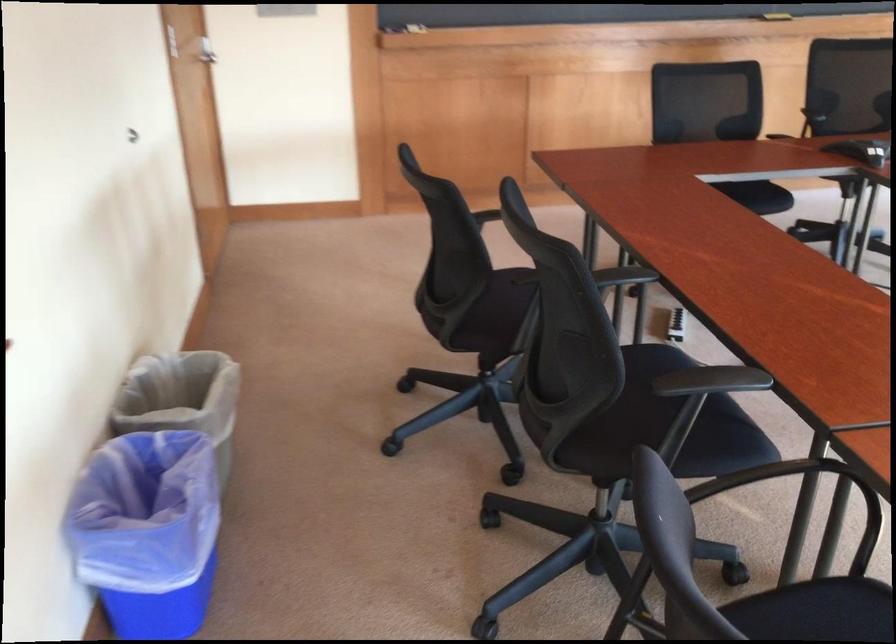
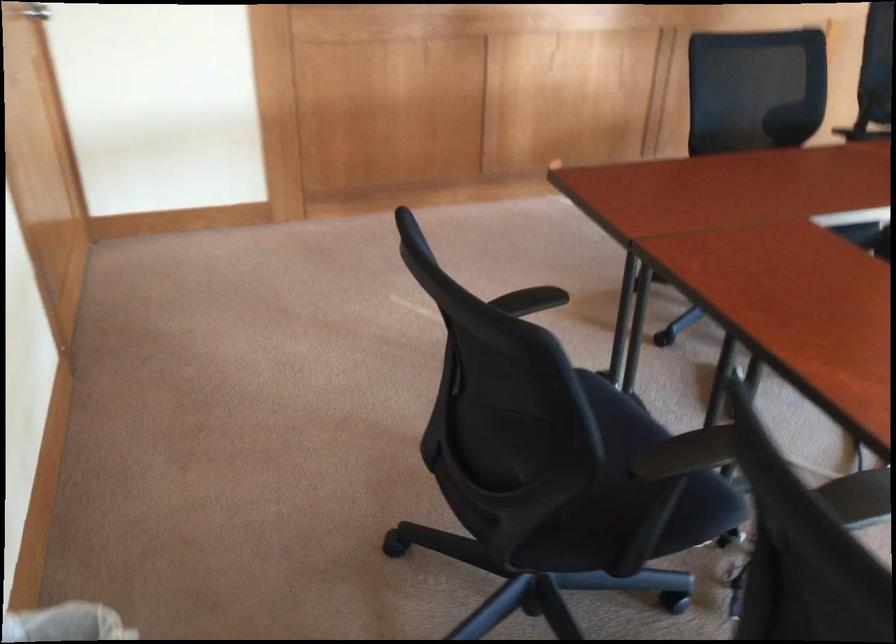
Question: In a continuous first-person perspective shot, in which direction is the camera moving?

Choices:
 (A) Left
 (B) Right
 (C) Forward
 (D) Backward

Answer: (C)